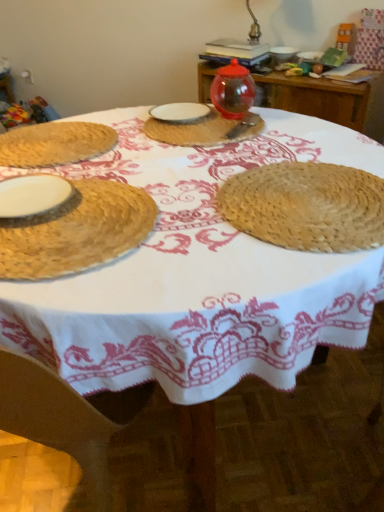
What are the coordinates of `vacant space that is in between white ceramic plate at center, acting as the third tableware starting from the bottom, and natural straw placemat at center` in the screenshot? It's located at (227, 149).